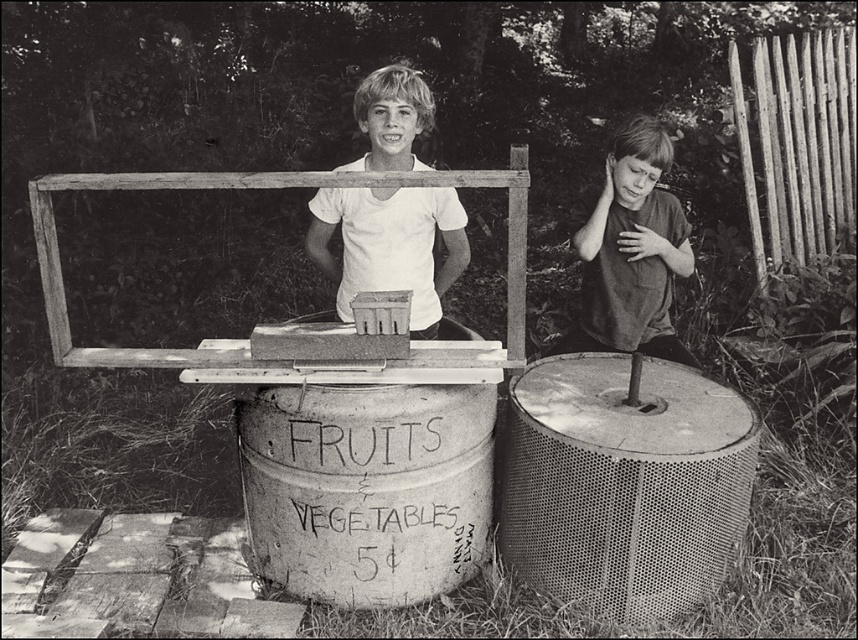
Question: Among these points, which one is nearest to the camera?

Choices:
 (A) (378, 83)
 (B) (639, 262)

Answer: (A)

Question: Observing the image, what is the correct spatial positioning of white matte shirt at center in reference to dark gray shirt at right?

Choices:
 (A) above
 (B) below

Answer: (A)

Question: Among these objects, which one is nearest to the camera?

Choices:
 (A) dark gray shirt at right
 (B) white matte shirt at center

Answer: (B)

Question: Among these points, which one is nearest to the camera?

Choices:
 (A) (378, 272)
 (B) (654, 211)

Answer: (A)

Question: Is white matte shirt at center smaller than dark gray shirt at right?

Choices:
 (A) no
 (B) yes

Answer: (A)

Question: Does white matte shirt at center appear on the left side of dark gray shirt at right?

Choices:
 (A) yes
 (B) no

Answer: (A)